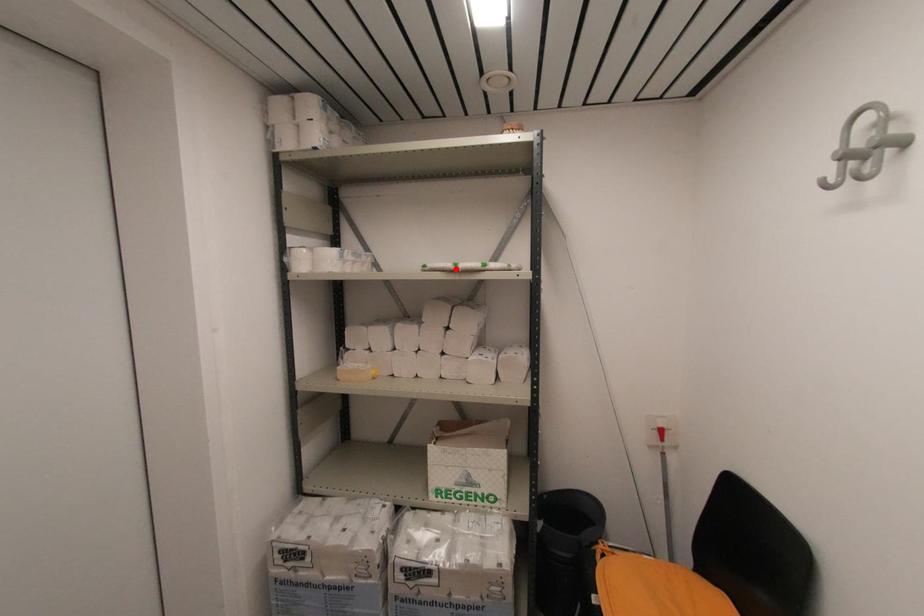
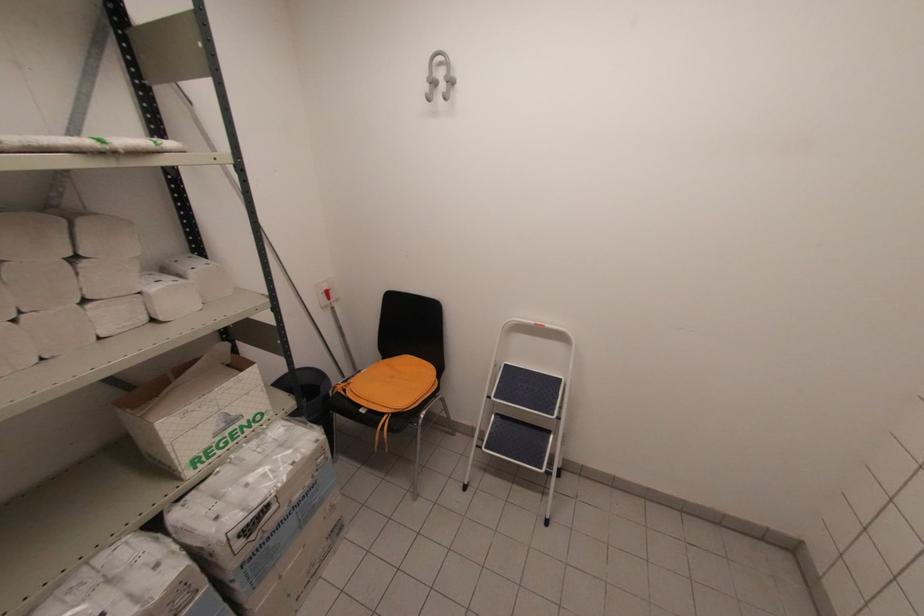
In the second image, find the point that corresponds to the highlighted location in the first image.

(107, 148)